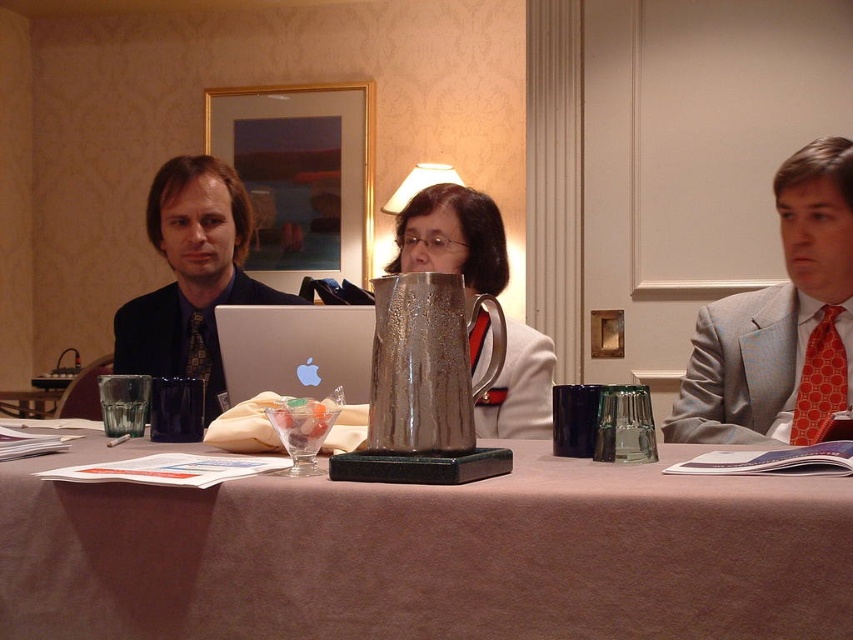
Does silver textured pitcher at center have a lesser height compared to silver metallic laptop at center?

Incorrect, silver textured pitcher at center's height does not fall short of silver metallic laptop at center's.

Does silver textured pitcher at center have a greater height compared to silver metallic laptop at center?

Correct, silver textured pitcher at center is much taller as silver metallic laptop at center.

Is point (410, 252) behind point (318, 390)?

That is True.

Locate an element on the screen. Image resolution: width=853 pixels, height=640 pixels. silver textured pitcher at center is located at coordinates (451, 237).

Who is more forward, (x=740, y=374) or (x=206, y=314)?

Point (x=740, y=374)

Who is positioned more to the left, light gray suit at right or black textured tie at left?

black textured tie at left is more to the left.

Where is `light gray suit at right`? This screenshot has height=640, width=853. light gray suit at right is located at coordinates (737, 369).

Find the location of `light gray suit at right`. light gray suit at right is located at coordinates (737, 369).

Is point (231, 193) behind point (775, 353)?

That is True.

Which is behind, point (215, 230) or point (770, 416)?

The point (215, 230) is more distant.

Identify the location of brushed metal laptop at left. (190, 276).